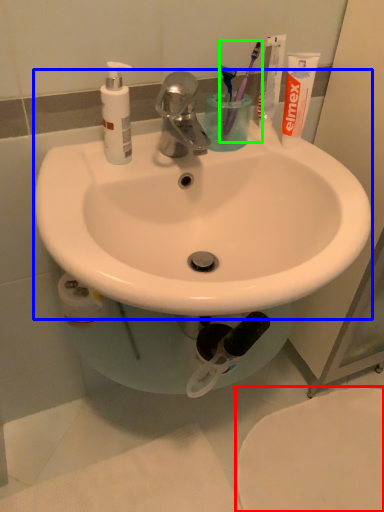
Question: Estimate the real-world distances between objects in this image. Which object is farther from bidet (highlighted by a red box), sink (highlighted by a blue box) or toothbrush (highlighted by a green box)?

Choices:
 (A) sink
 (B) toothbrush

Answer: (B)